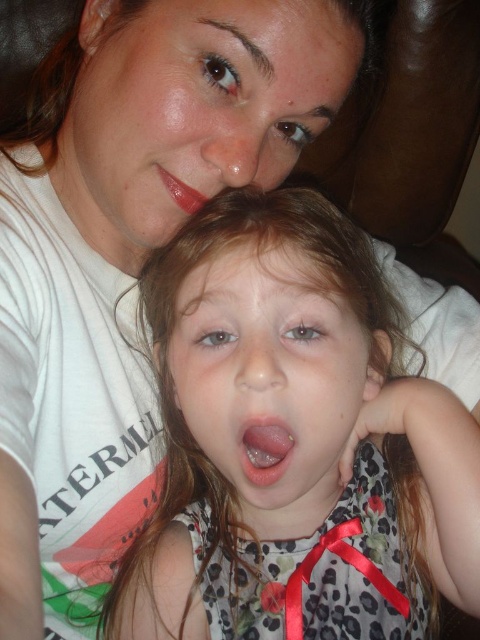
You are a photographer standing 20 inches away from the smooth skin face at center. Can you take a clear photo of it without moving closer?

The smooth skin face at center is 15.99 inches away from the viewer, so you are already closer than 20 inches. Therefore, you can take a clear photo without moving closer.

You are standing in the room and see two points marked in the image. Which point is closer to you, point (267, 104) or point (202, 353)?

Point (267, 104) is closer to you because it is further to the viewer than point (202, 353).